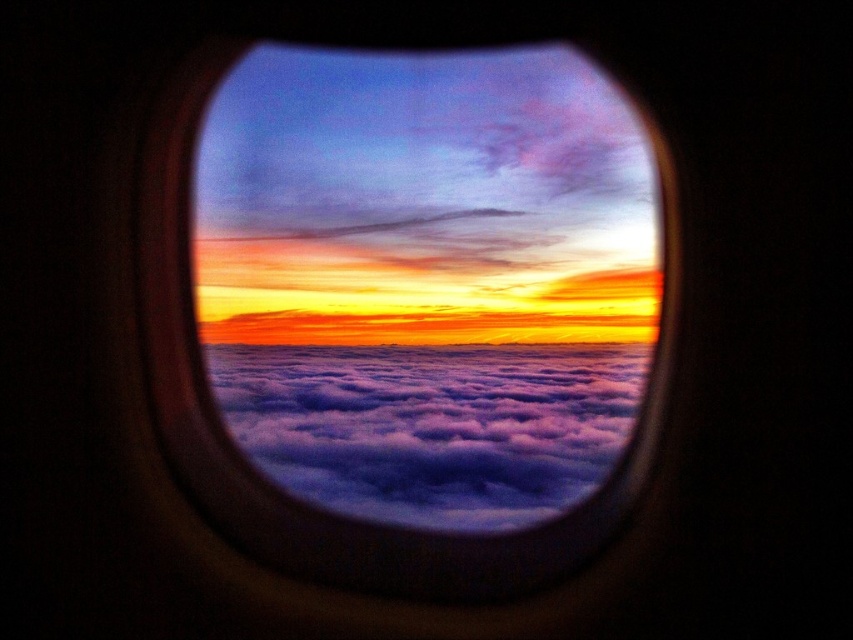
Who is higher up, transparent glass airplane window at center or cloudy at center?

Positioned higher is transparent glass airplane window at center.

Which of these two, transparent glass airplane window at center or cloudy at center, stands shorter?

Standing shorter between the two is cloudy at center.

In the scene shown: Who is more distant from viewer, (351, 336) or (358, 396)?

Positioned behind is point (351, 336).

Identify the location of transparent glass airplane window at center. The width and height of the screenshot is (853, 640). (427, 278).